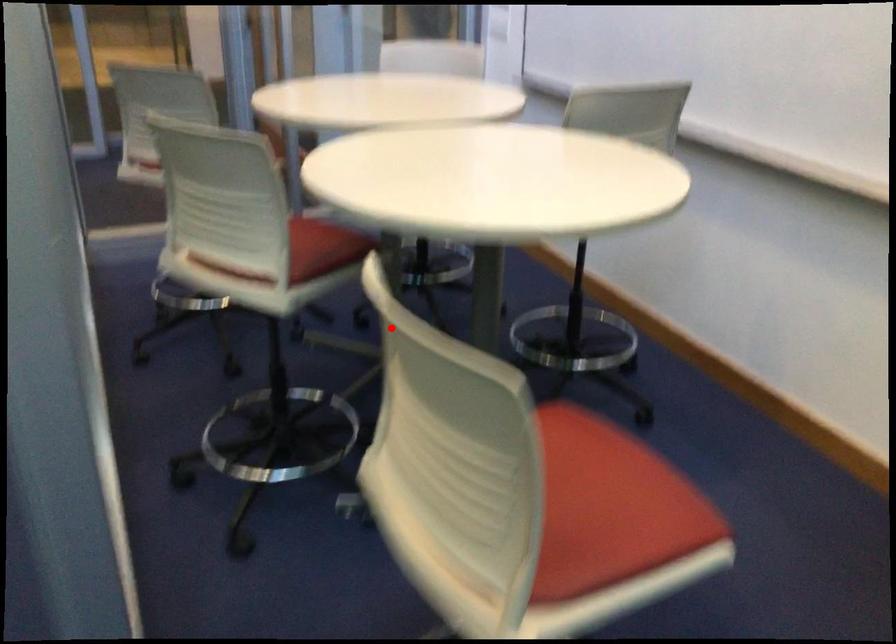
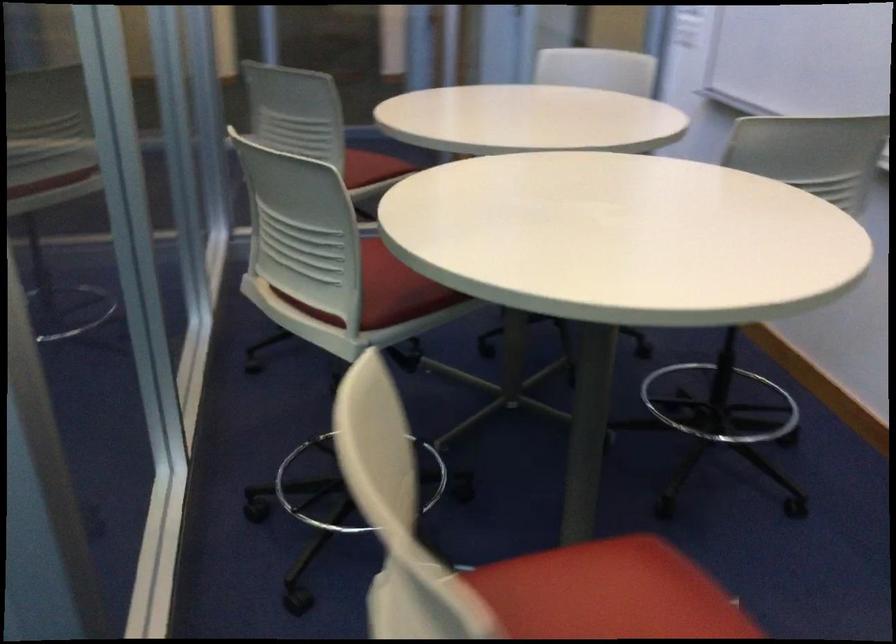
Find the pixel in the second image that matches the highlighted location in the first image.

(348, 487)